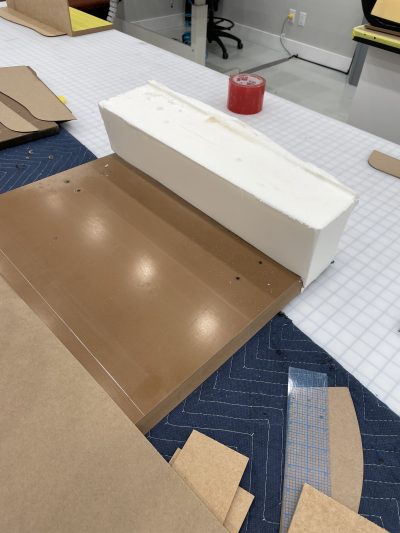
Find the location of a particular element. tape roll is located at coordinates (248, 94).